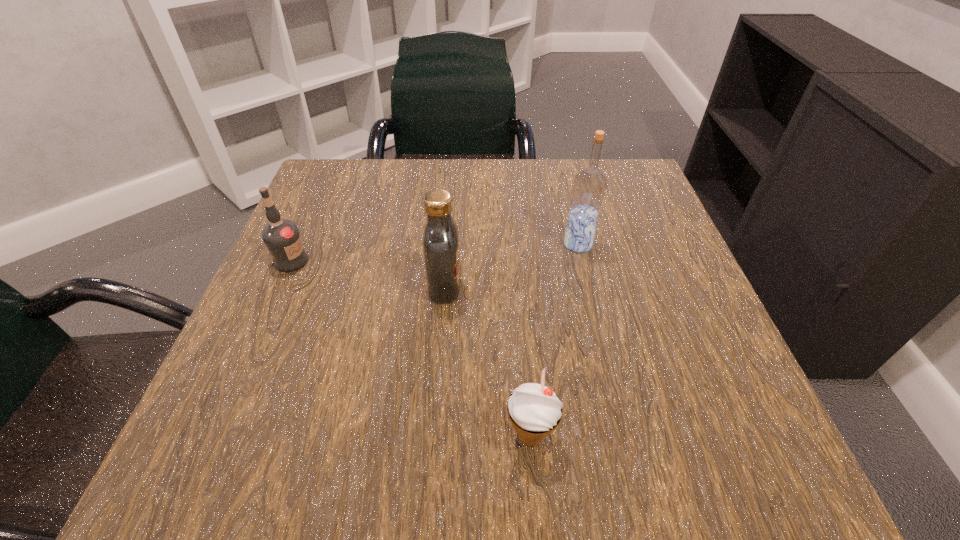
Image resolution: width=960 pixels, height=540 pixels. Find the location of `the rightmost object`. the rightmost object is located at coordinates (589, 186).

At what (x,y) coordinates should I click in order to perform the action: click on the tallest vodka. Please return your answer as a coordinate pair (x, y). The image size is (960, 540). Looking at the image, I should click on (589, 186).

The image size is (960, 540). What are the coordinates of `the second vodka from right to left` in the screenshot? It's located at (441, 239).

In order to click on the third shortest object in this screenshot , I will do `click(441, 239)`.

This screenshot has width=960, height=540. I want to click on the leftmost vodka, so click(282, 237).

Locate an element on the screen. The image size is (960, 540). the third tallest object is located at coordinates (282, 237).

At what (x,y) coordinates should I click in order to perform the action: click on the nearest object. Please return your answer as a coordinate pair (x, y). The width and height of the screenshot is (960, 540). Looking at the image, I should click on (x=534, y=407).

Where is `the third object from left to right`? the third object from left to right is located at coordinates (534, 407).

The image size is (960, 540). In order to click on vacant space located 0.200m on the back of the rightmost vodka in this screenshot , I will do `click(563, 179)`.

This screenshot has width=960, height=540. In order to click on free location located on the front-facing side of the second vodka from right to left in this screenshot , I will do `click(516, 287)`.